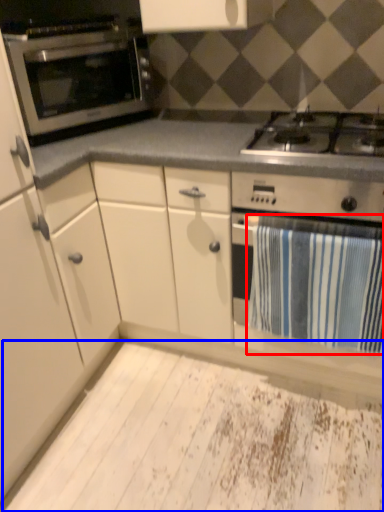
Question: Among these objects, which one is nearest to the camera, bath towel (highlighted by a red box) or plywood (highlighted by a blue box)?

Choices:
 (A) bath towel
 (B) plywood

Answer: (B)